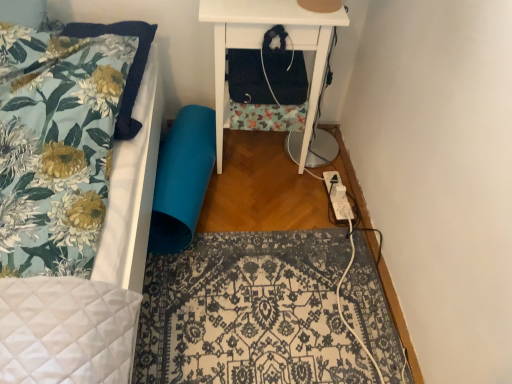
Identify the location of vacant area that is in front of white matte nightstand at upper right. (249, 206).